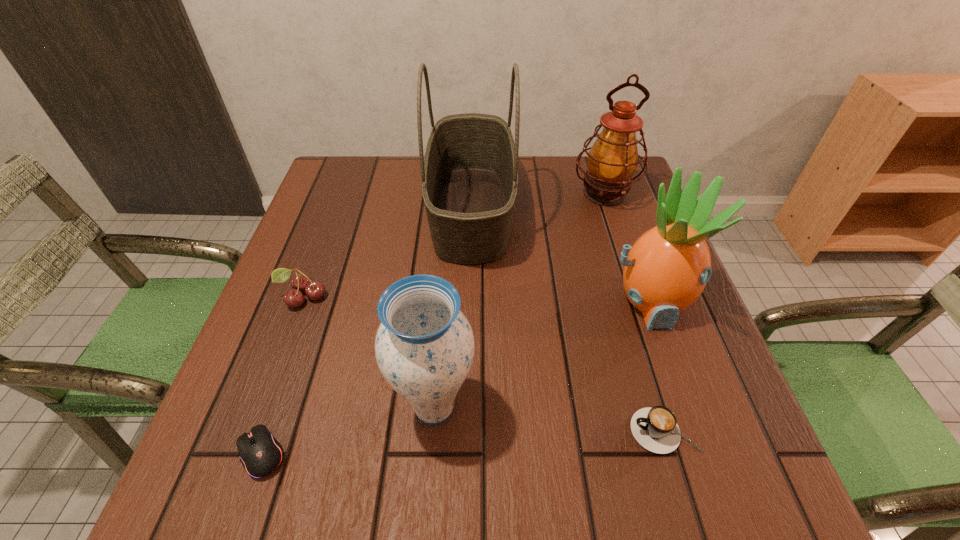
Locate an element on the screen. vacant point located 0.220m on the left of the vase is located at coordinates (266, 408).

Identify the location of free space located 0.310m on the leaves of the cherry. (241, 463).

This screenshot has height=540, width=960. In order to click on vacant area situated 0.270m with the handle on the side of the cappuccino in this screenshot , I will do `click(468, 431)`.

The height and width of the screenshot is (540, 960). I want to click on vacant space located 0.270m with the handle on the side of the cappuccino, so click(x=468, y=431).

You are a GUI agent. You are given a task and a screenshot of the screen. Output one action in this format:
    pyautogui.click(x=<x>, y=<y>)
    Task: Click on the vacant region located with the handle on the side of the cappuccino
    
    Given the screenshot: What is the action you would take?
    pyautogui.click(x=559, y=431)

Identify the location of vacant area located on the right of the computer mouse. (448, 453).

At what (x,y) coordinates should I click in order to perform the action: click on basket that is at the far edge. Please return your answer as a coordinate pair (x, y). Looking at the image, I should click on (469, 173).

The width and height of the screenshot is (960, 540). In order to click on oil lamp located in the far edge section of the desktop in this screenshot , I will do `click(612, 160)`.

At what (x,y) coordinates should I click in order to perform the action: click on cappuccino present at the near edge. Please return your answer as a coordinate pair (x, y). Looking at the image, I should click on (656, 429).

Image resolution: width=960 pixels, height=540 pixels. Find the location of `computer mouse that is positioned at the near edge`. computer mouse that is positioned at the near edge is located at coordinates (260, 453).